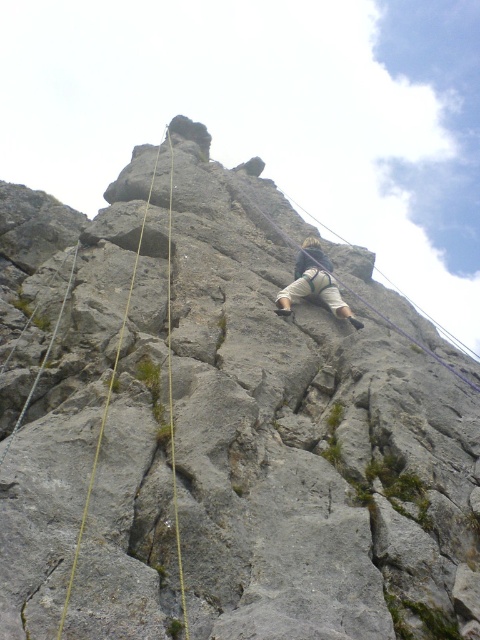
Can you confirm if tan fabric pants at center is taller than yellow rope at center?

In fact, tan fabric pants at center may be shorter than yellow rope at center.

Does tan fabric pants at center have a smaller size compared to yellow rope at center?

Correct, tan fabric pants at center occupies less space than yellow rope at center.

Identify the location of tan fabric pants at center. Image resolution: width=480 pixels, height=640 pixels. (313, 284).

Find the location of a particular element. This screenshot has width=480, height=640. tan fabric pants at center is located at coordinates pyautogui.click(x=313, y=284).